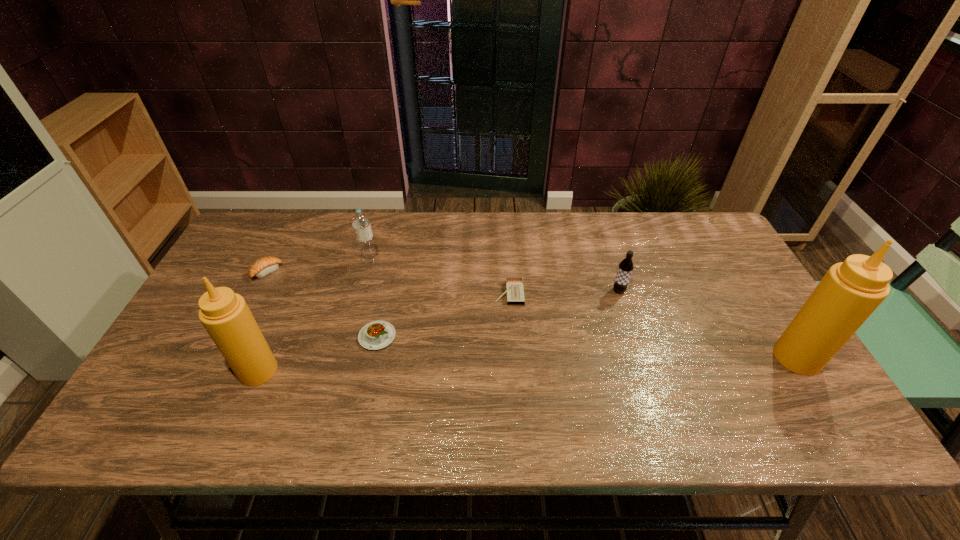
Locate an element on the screen. The height and width of the screenshot is (540, 960). vacant area that satisfies the following two spatial constraints: 1. on the front side of the fourth tallest object; 2. on the striking surface of the shortest object is located at coordinates (620, 294).

The width and height of the screenshot is (960, 540). What are the coordinates of `free space that satisfies the following two spatial constraints: 1. on the front side of the second object from right to left; 2. on the right side of the sushi` in the screenshot? It's located at (257, 291).

Image resolution: width=960 pixels, height=540 pixels. What are the coordinates of `blank area in the image that satisfies the following two spatial constraints: 1. on the front side of the sixth object from left to right; 2. on the right side of the third tallest object` in the screenshot? It's located at (362, 291).

You are a GUI agent. You are given a task and a screenshot of the screen. Output one action in this format:
    pyautogui.click(x=<x>, y=<y>)
    Task: Click on the vacant position in the image that satisfies the following two spatial constraints: 1. on the front side of the sushi; 2. on the right side of the sixth shortest object
    The width and height of the screenshot is (960, 540).
    Given the screenshot: What is the action you would take?
    [x=217, y=370]

Identify the location of vacant point that satisfies the following two spatial constraints: 1. on the front side of the leftmost object; 2. on the left side of the left condiment. (217, 370).